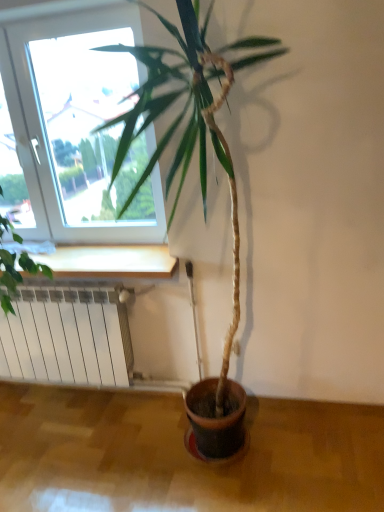
What do you see at coordinates (66, 337) in the screenshot? Image resolution: width=384 pixels, height=512 pixels. I see `white metallic radiator at lower left` at bounding box center [66, 337].

This screenshot has height=512, width=384. Find the location of `white metallic radiator at lower left`. white metallic radiator at lower left is located at coordinates (66, 337).

You are a GUI agent. You are given a task and a screenshot of the screen. Output one action in this format:
    pyautogui.click(x=<x>, y=<y>)
    Task: Click on the white metallic radiator at lower left
    
    Given the screenshot: What is the action you would take?
    pyautogui.click(x=66, y=337)